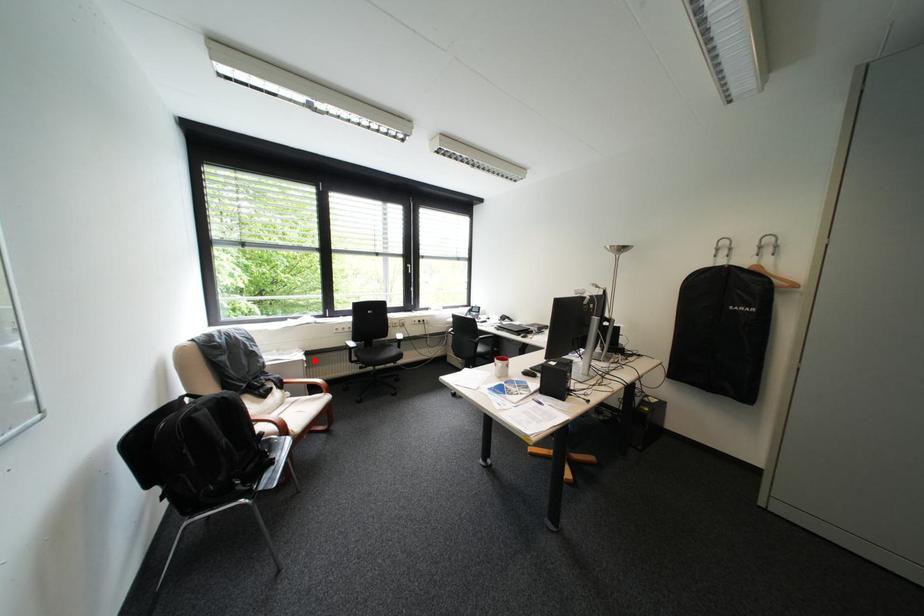
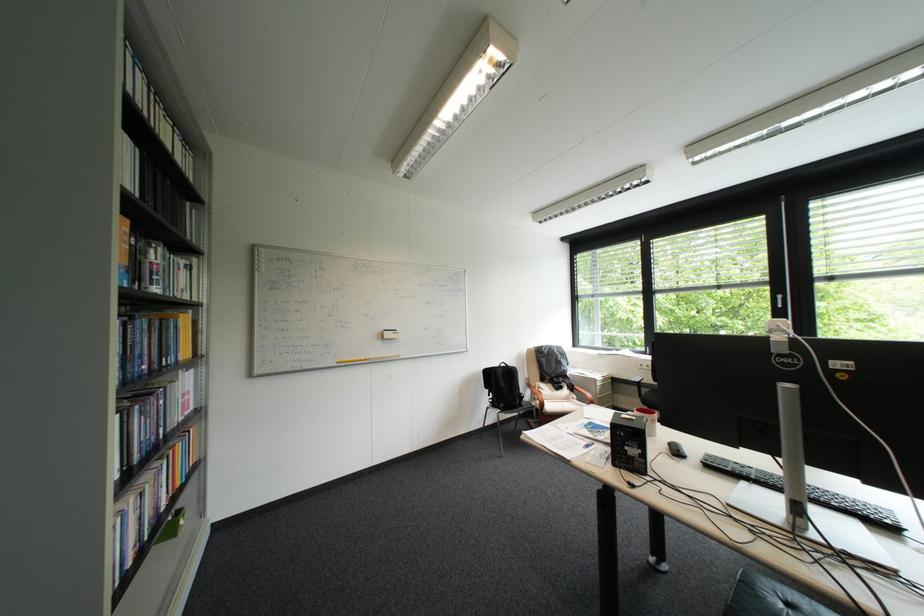
Question: A red point is marked in image1. In image2, is the corresponding 3D point closer to the camera or farther? Reply with the corresponding letter.

Choices:
 (A) The corresponding 3D point is closer.
 (B) The corresponding 3D point is farther.

Answer: (B)